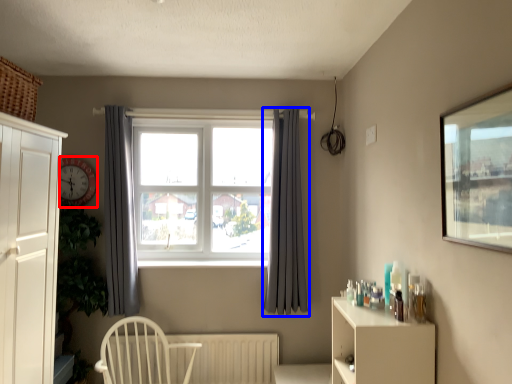
Question: Which point is closer to the camera, clock (highlighted by a red box) or curtain (highlighted by a blue box)?

Choices:
 (A) clock
 (B) curtain

Answer: (B)